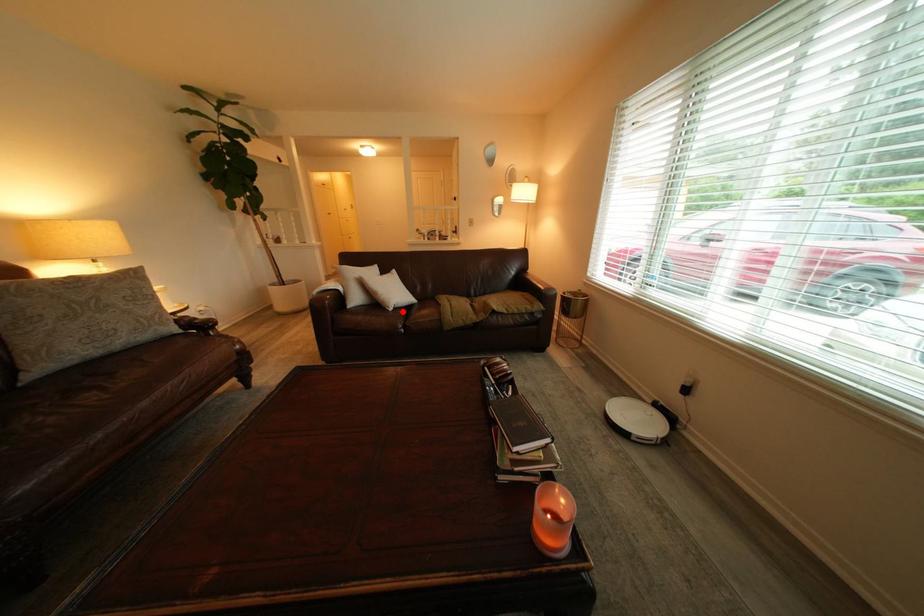
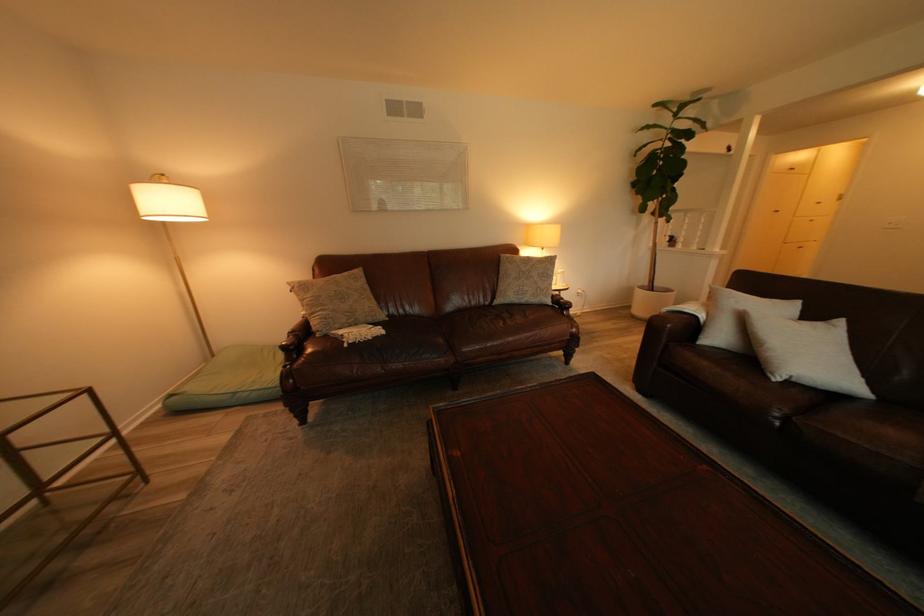
Question: I am providing you with two images of the same scene from different viewpoints. In image1, a red point is highlighted. Considering the same 3D point in image2, which of the following is correct?

Choices:
 (A) It is closer
 (B) It is farther

Answer: (B)